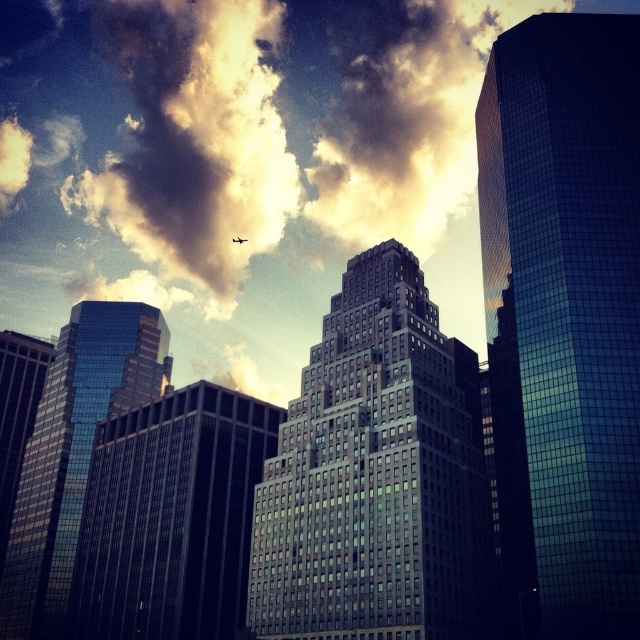
You are a drone operator planning to fly a drone between the glassy skyscraper at center and the black matte airplane at upper center. The drone has a wingspan of 1 meter. Based on the scene, can you determine if there is enough space between them for the drone to pass safely?

The glassy skyscraper at center might be wider than black matte airplane at upper center, so there may not be enough space for the drone to pass safely between them. It is recommended to check the exact dimensions before proceeding.

You are an architect evaluating the feasibility of installing a large billboard on the glossy glass skyscraper at upper right. Considering the size of the black matte airplane at upper center that frequently passes nearby, will the billboard obstruct the airplane pilots? Please explain your reasoning based on the relative sizes of the two objects.

The glossy glass skyscraper at upper right is bigger than the black matte airplane at upper center. Since the billboard would be placed on the larger skyscraper, it might still be visible to pilots, but the exact obstruction depends on the billboard size and placement. However, the skyscraper is larger, so the billboard could potentially block the airplane pilots if not positioned carefully.

You are a pilot flying a small airplane and want to navigate through the clouds. According to the coordinates provided, where exactly is the cloudy sky at upper center located?

The cloudy sky at upper center is located at coordinates point (192, 147).